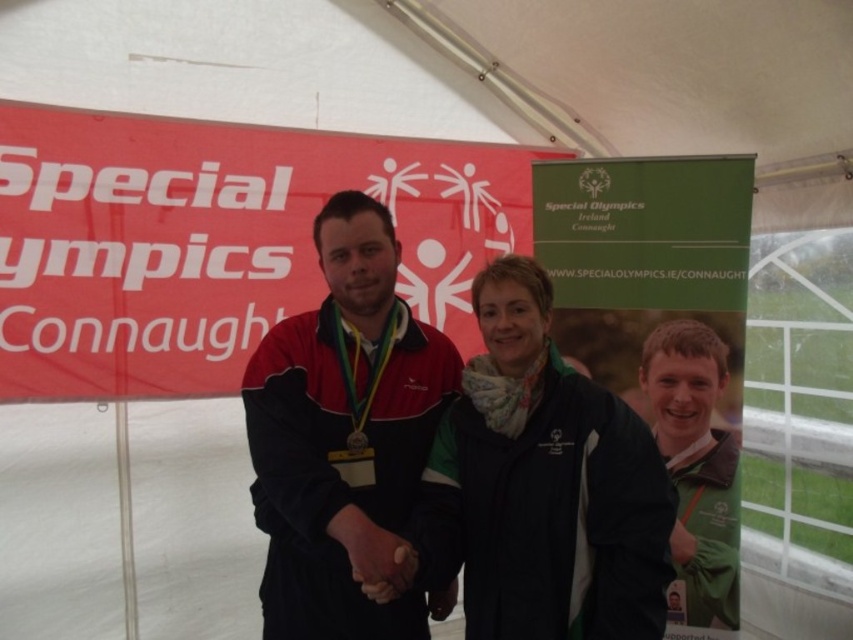
Looking at this image, you are at the Special Olympics event in Connaught, Ireland, and you see the matte black jacket at center. Where is it located in the image?

The matte black jacket at center is located at point (345, 436).

You are a photographer trying to capture a group photo of the matte black jacket at center and the green fabric jacket at center. If you want to ensure both jackets are fully visible in the frame, which jacket should you position closer to the camera to avoid cropping?

The matte black jacket at center is wider than the green fabric jacket at center, so positioning the matte black jacket at center closer to the camera will ensure its full visibility without cropping.